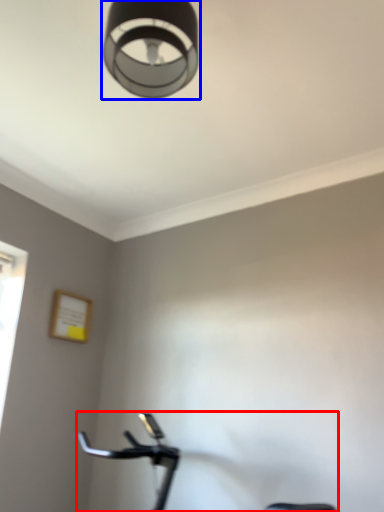
Question: Which point is further to the camera, stationary bicycle (highlighted by a red box) or lamp (highlighted by a blue box)?

Choices:
 (A) stationary bicycle
 (B) lamp

Answer: (A)